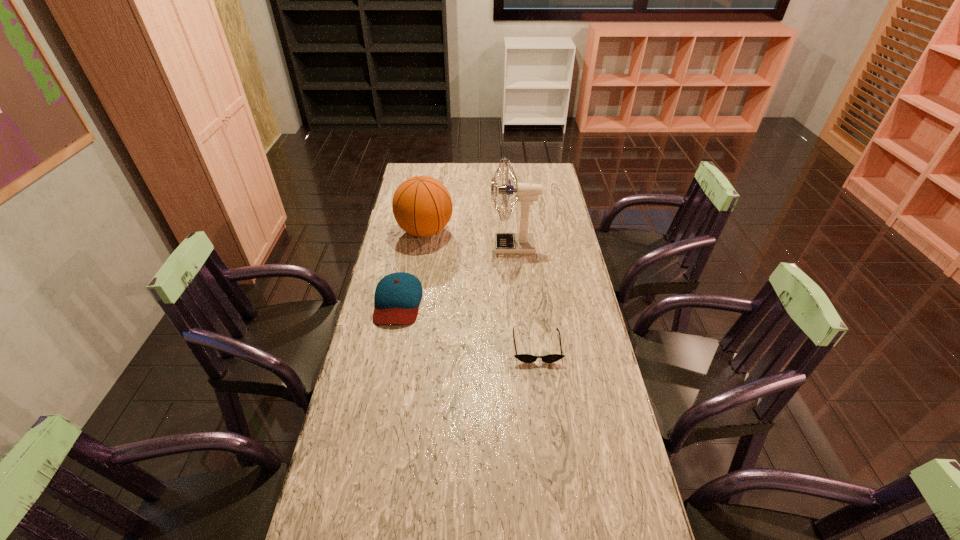
Locate an element on the screen. Image resolution: width=960 pixels, height=540 pixels. fan is located at coordinates (523, 242).

The height and width of the screenshot is (540, 960). What are the coordinates of `basketball` in the screenshot? It's located at (422, 206).

Find the location of a particular element. the second shortest object is located at coordinates (397, 297).

Where is `the third farthest object`? The height and width of the screenshot is (540, 960). the third farthest object is located at coordinates (x=397, y=297).

This screenshot has height=540, width=960. I want to click on the nearest object, so click(x=526, y=358).

In order to click on the shortest object in this screenshot , I will do coord(526,358).

Identify the location of vacant space positioned on the front-facing side of the tallest object. (478, 246).

The height and width of the screenshot is (540, 960). I want to click on free space located on the front-facing side of the tallest object, so click(470, 246).

Locate an element on the screen. free space located 0.370m on the front-facing side of the tallest object is located at coordinates (399, 246).

At what (x,y) coordinates should I click in order to perform the action: click on free location located 0.340m on the front of the basketball. Please return your answer as a coordinate pair (x, y). Looking at the image, I should click on (413, 310).